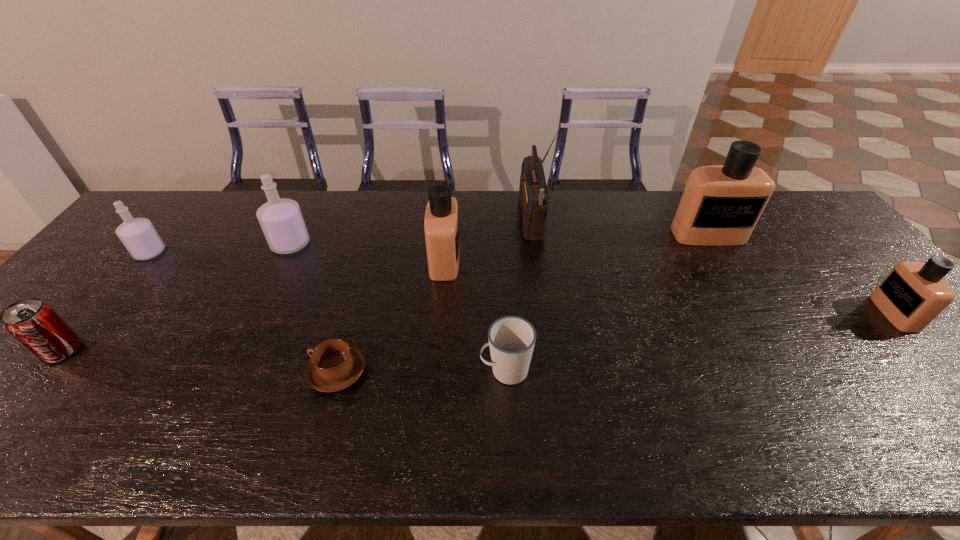
Image resolution: width=960 pixels, height=540 pixels. I want to click on the smaller purple perfume, so click(x=138, y=235).

Where is `the leftmost perfume`? This screenshot has width=960, height=540. the leftmost perfume is located at coordinates (138, 235).

Identify the location of red pop soda. (35, 325).

At what (x,y) coordinates should I click in order to perform the action: click on cup. Please return your answer as a coordinate pair (x, y). Looking at the image, I should click on (511, 338).

Image resolution: width=960 pixels, height=540 pixels. Identify the location of the sixth object from left to right. (511, 338).

Identify the location of the sixth object from right to left. (335, 365).

I want to click on cappuccino, so click(335, 365).

Find the location of a particular element. The image size is (960, 540). vacant space positioned on the front-facing side of the radio receiver is located at coordinates (444, 218).

The height and width of the screenshot is (540, 960). Identify the location of vacant region located 0.300m on the front-facing side of the radio receiver. (429, 218).

Identify the location of vacant region located 0.350m on the front-facing side of the radio receiver. The width and height of the screenshot is (960, 540). (414, 218).